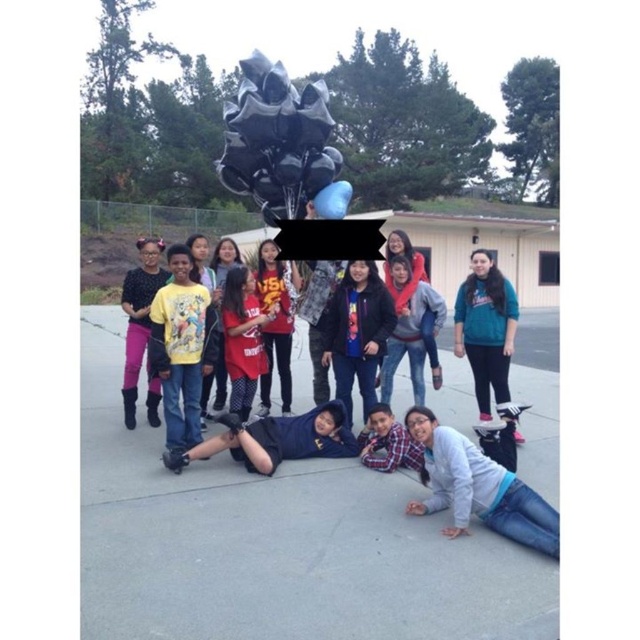
Question: Which object is positioned closest to the black matte hoodie at center?

Choices:
 (A) teal fleece jacket at lower right
 (B) matte black shirt at center

Answer: (B)

Question: Does teal fleece jacket at lower right have a greater width compared to black matte hoodie at center?

Choices:
 (A) yes
 (B) no

Answer: (B)

Question: Which point is farther from the camera taking this photo?

Choices:
 (A) (145, 273)
 (B) (483, 307)

Answer: (A)

Question: Which of the following is the closest to the observer?

Choices:
 (A) teal fleece jacket at lower right
 (B) plaid shirt at lower center

Answer: (B)

Question: Is black matte hoodie at center wider than plaid shirt at lower center?

Choices:
 (A) no
 (B) yes

Answer: (B)

Question: Considering the relative positions of jeans at lower right and plaid shirt at lower center in the image provided, where is jeans at lower right located with respect to plaid shirt at lower center?

Choices:
 (A) above
 (B) below

Answer: (B)